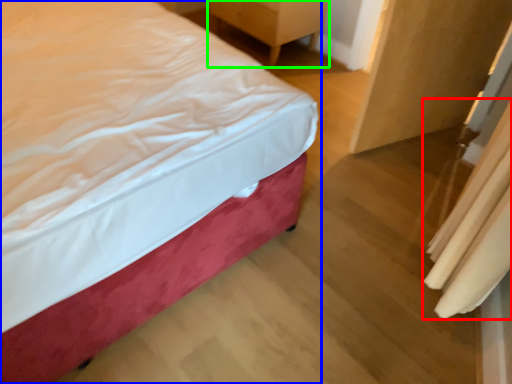
Question: Considering the real-world distances, which object is closest to curtain (highlighted by a red box)? bed (highlighted by a blue box) or furniture (highlighted by a green box).

Choices:
 (A) bed
 (B) furniture

Answer: (A)